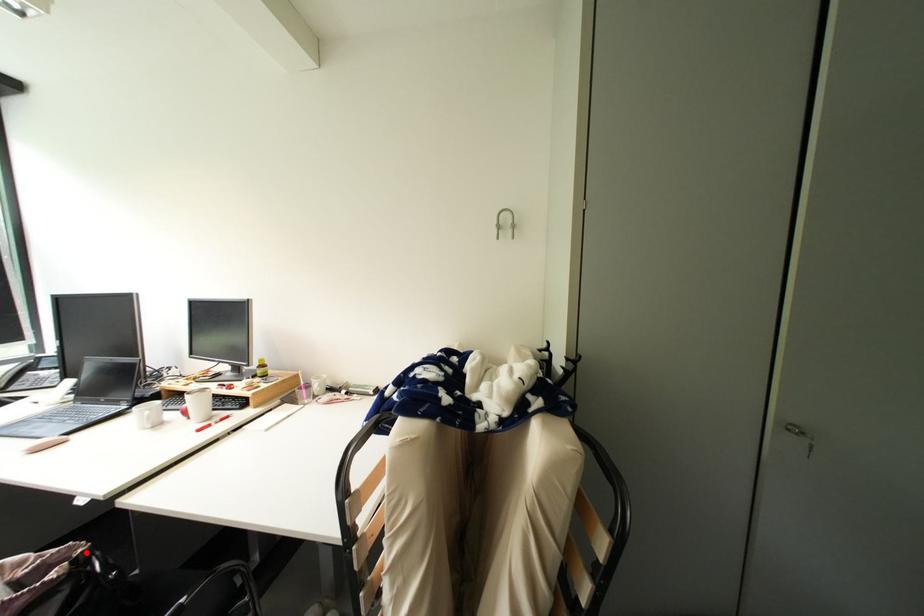
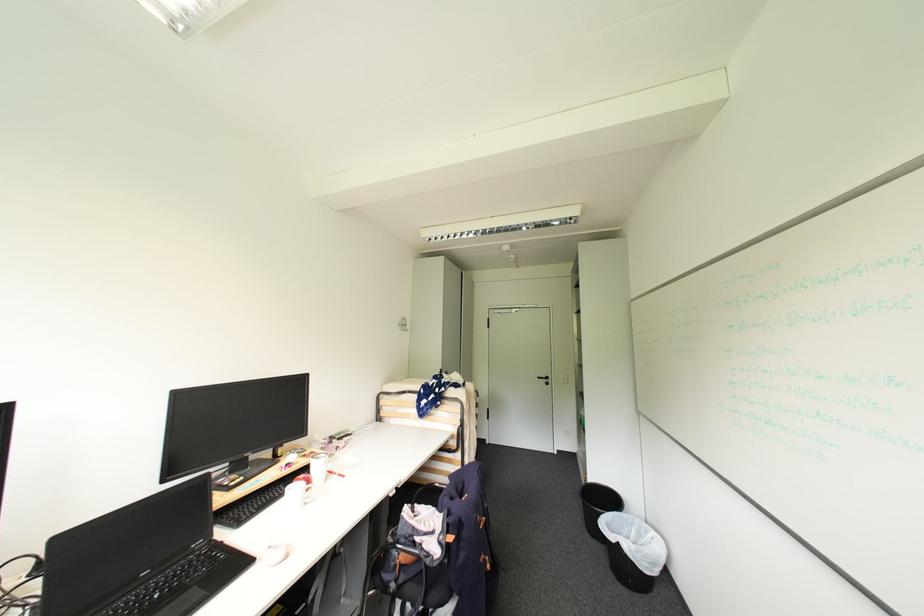
Question: A red point is marked in image1. In image2, is the corresponding 3D point closer to the camera or farther? Reply with the corresponding letter.

Choices:
 (A) The corresponding 3D point is closer.
 (B) The corresponding 3D point is farther.

Answer: (A)